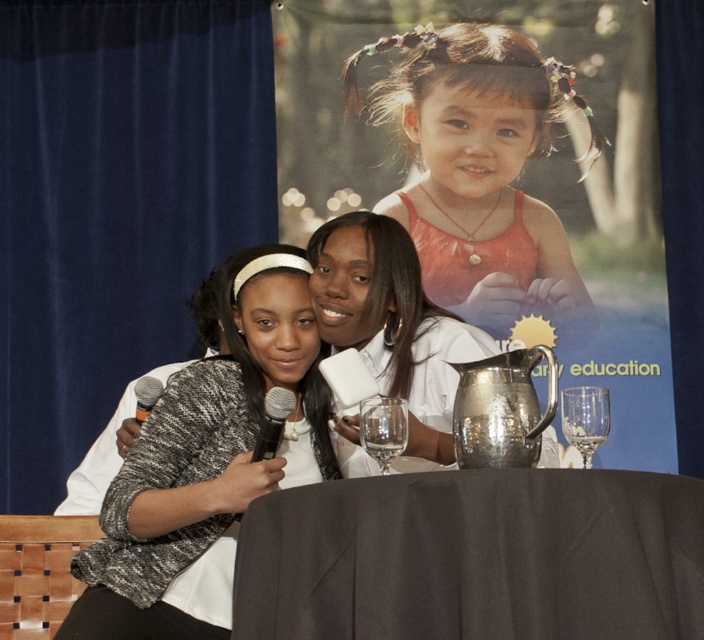
Does gray knit sweater at center have a greater width compared to black metallic microphone at center?

Yes.

Is point (70, 566) positioned after point (265, 408)?

Yes, point (70, 566) is farther from viewer.

The width and height of the screenshot is (704, 640). In order to click on gray knit sweater at center in this screenshot , I will do `click(206, 467)`.

Between black fabric table at center and transparent glass wine glass at center, which one appears on the right side from the viewer's perspective?

black fabric table at center

Between point (577, 499) and point (370, 454), which one is positioned behind?

Positioned behind is point (370, 454).

Describe the element at coordinates (474, 556) in the screenshot. The height and width of the screenshot is (640, 704). I see `black fabric table at center` at that location.

The height and width of the screenshot is (640, 704). In order to click on black fabric table at center in this screenshot , I will do `click(474, 556)`.

Which of these two, white glossy microphone at center or transparent glass at lower right, stands shorter?

With less height is transparent glass at lower right.

Does white glossy microphone at center have a greater width compared to transparent glass at lower right?

Yes.

Is point (353, 259) farther from viewer compared to point (582, 413)?

Yes, point (353, 259) is farther from viewer.

Identify the location of white glossy microphone at center. This screenshot has height=640, width=704. (391, 324).